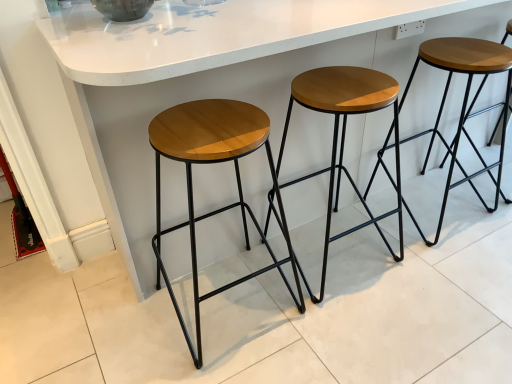
You are a GUI agent. You are given a task and a screenshot of the screen. Output one action in this format:
    pyautogui.click(x=<x>, y=<y>)
    Task: Click on the free space in front of wooden/matte stool at center, marked as the 2th stool in a left-to-right arrangement
    
    Given the screenshot: What is the action you would take?
    pyautogui.click(x=364, y=331)